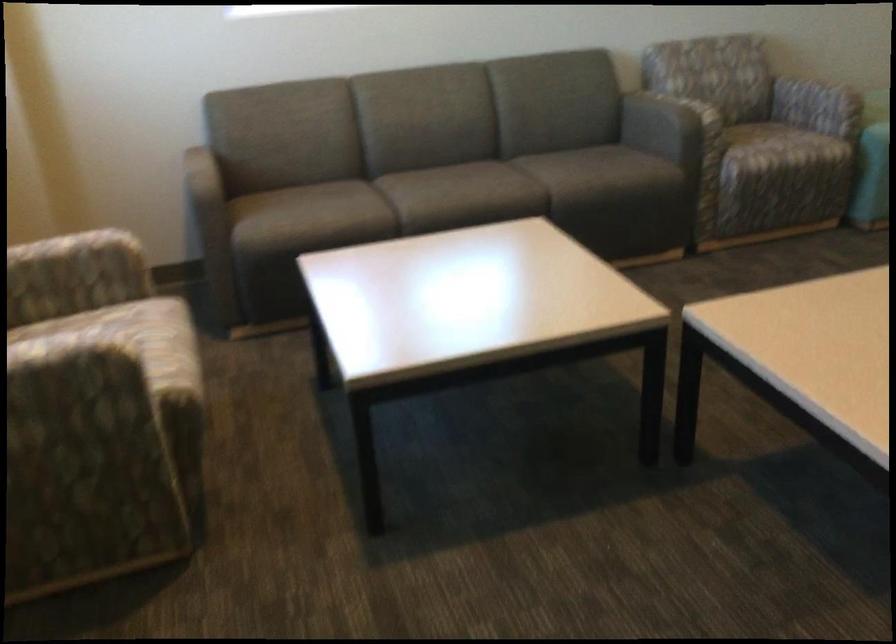
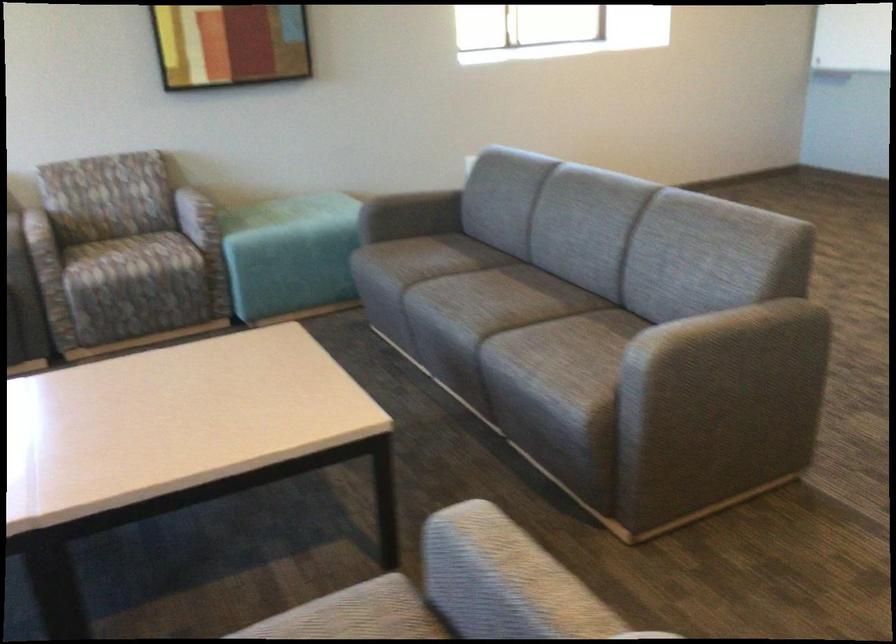
Question: What movement of the cameraman would produce the second image?

Choices:
 (A) Left
 (B) Right
 (C) Forward
 (D) Backward

Answer: (B)